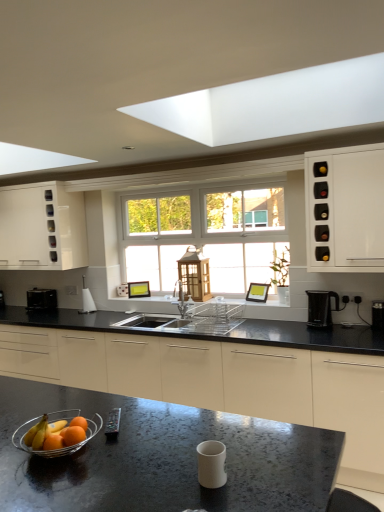
Find the location of a particular element. The image size is (384, 512). free region on the left part of white matte cup at center, the second appliance positioned from the right is located at coordinates (164, 477).